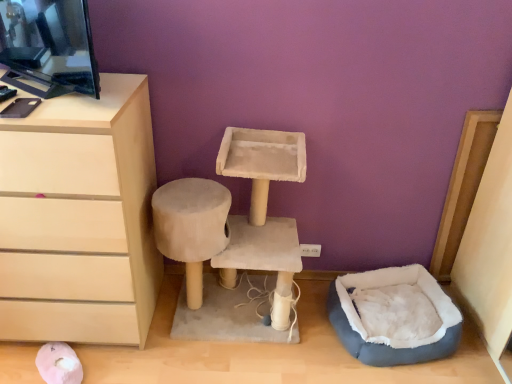
Question: Is beige suede cat tree at center at the left side of matte beige chest of drawers at left?

Choices:
 (A) yes
 (B) no

Answer: (B)

Question: From the image's perspective, is beige suede cat tree at center over matte beige chest of drawers at left?

Choices:
 (A) yes
 (B) no

Answer: (B)

Question: From a real-world perspective, is beige suede cat tree at center over matte beige chest of drawers at left?

Choices:
 (A) yes
 (B) no

Answer: (B)

Question: Is there a large distance between beige suede cat tree at center and matte beige chest of drawers at left?

Choices:
 (A) yes
 (B) no

Answer: (B)

Question: Is beige suede cat tree at center bigger than matte beige chest of drawers at left?

Choices:
 (A) yes
 (B) no

Answer: (B)

Question: Considering the relative sizes of beige suede cat tree at center and matte beige chest of drawers at left in the image provided, is beige suede cat tree at center smaller than matte beige chest of drawers at left?

Choices:
 (A) yes
 (B) no

Answer: (A)

Question: Are matte beige chest of drawers at left and beige suede cat tree at center far apart?

Choices:
 (A) yes
 (B) no

Answer: (B)

Question: Is the surface of matte beige chest of drawers at left in direct contact with beige suede cat tree at center?

Choices:
 (A) yes
 (B) no

Answer: (B)

Question: Could beige suede cat tree at center be considered to be inside matte beige chest of drawers at left?

Choices:
 (A) yes
 (B) no

Answer: (B)

Question: Is matte beige chest of drawers at left at the right side of beige suede cat tree at center?

Choices:
 (A) yes
 (B) no

Answer: (B)

Question: Is matte beige chest of drawers at left closer to the viewer compared to beige suede cat tree at center?

Choices:
 (A) no
 (B) yes

Answer: (B)

Question: From a real-world perspective, does matte beige chest of drawers at left stand above beige suede cat tree at center?

Choices:
 (A) no
 (B) yes

Answer: (B)

Question: Is gray plush bean bag at lower right facing towards beige suede cat tree at center?

Choices:
 (A) no
 (B) yes

Answer: (A)